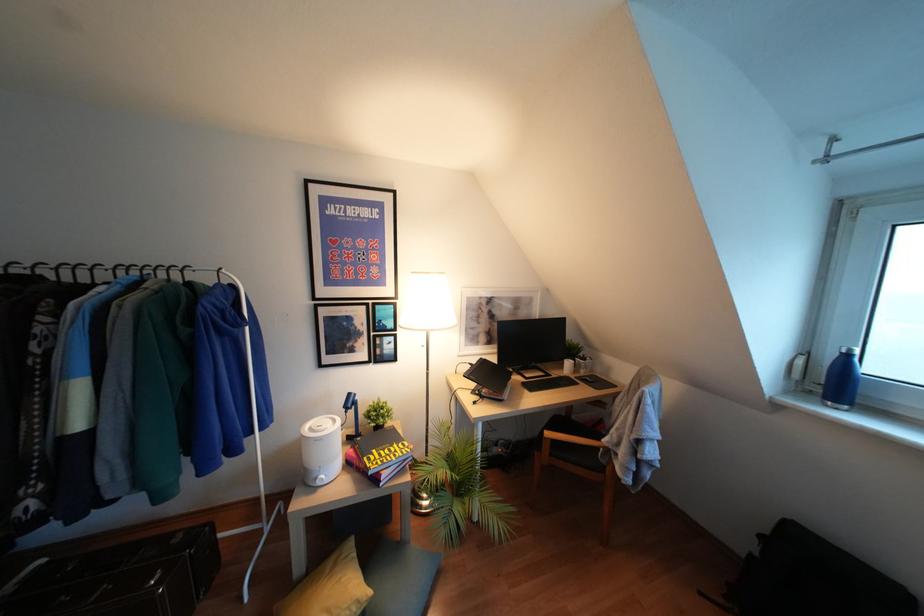
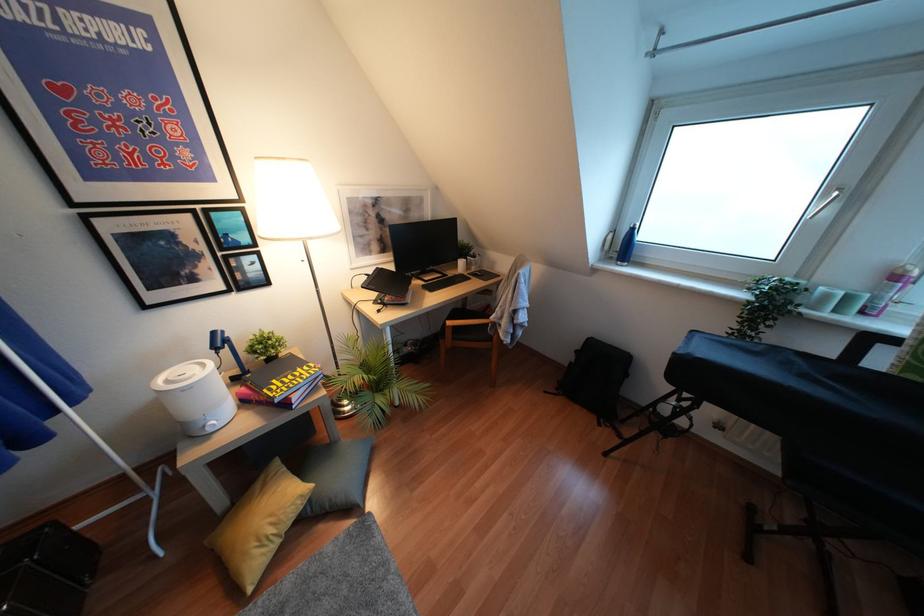
The point at (370, 472) is marked in the first image. Where is the corresponding point in the second image?

(275, 400)